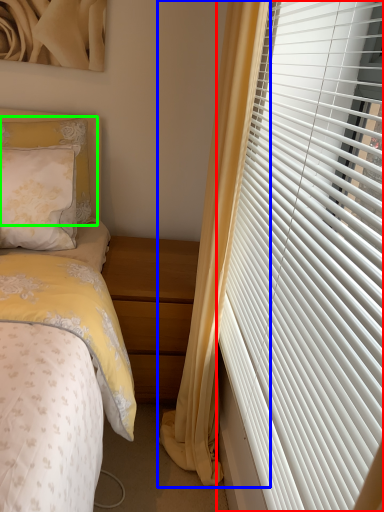
Question: Which object is positioned farthest from window blind (highlighted by a red box)? Select from curtain (highlighted by a blue box) and pillow (highlighted by a green box).

Choices:
 (A) curtain
 (B) pillow

Answer: (B)